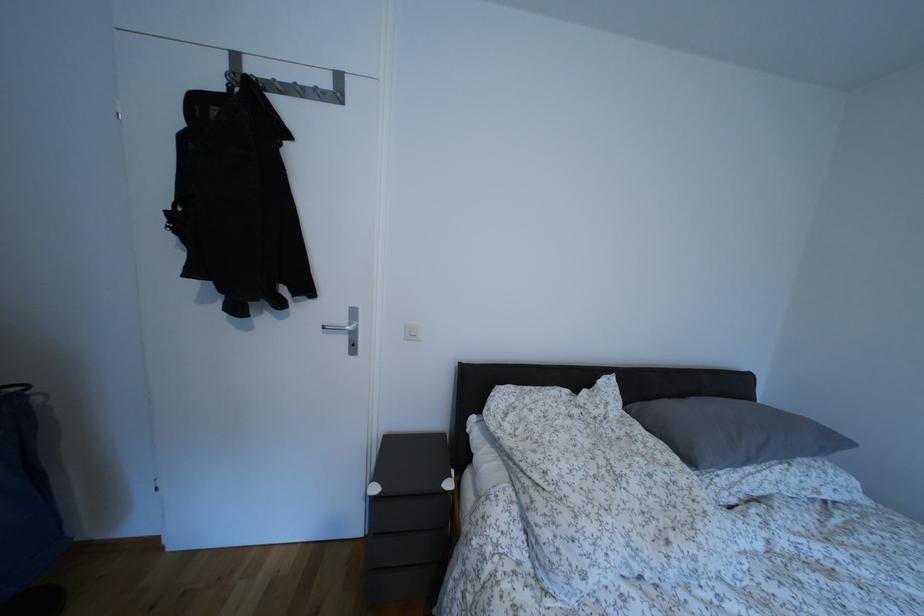
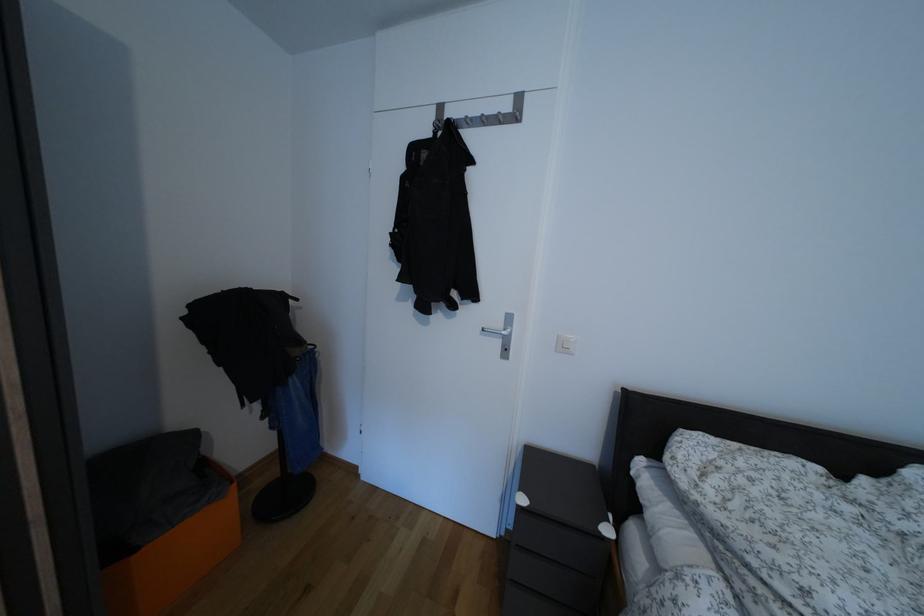
Question: In a continuous first-person perspective shot, in which direction is the camera moving?

Choices:
 (A) Left
 (B) Right
 (C) Forward
 (D) Backward

Answer: (A)